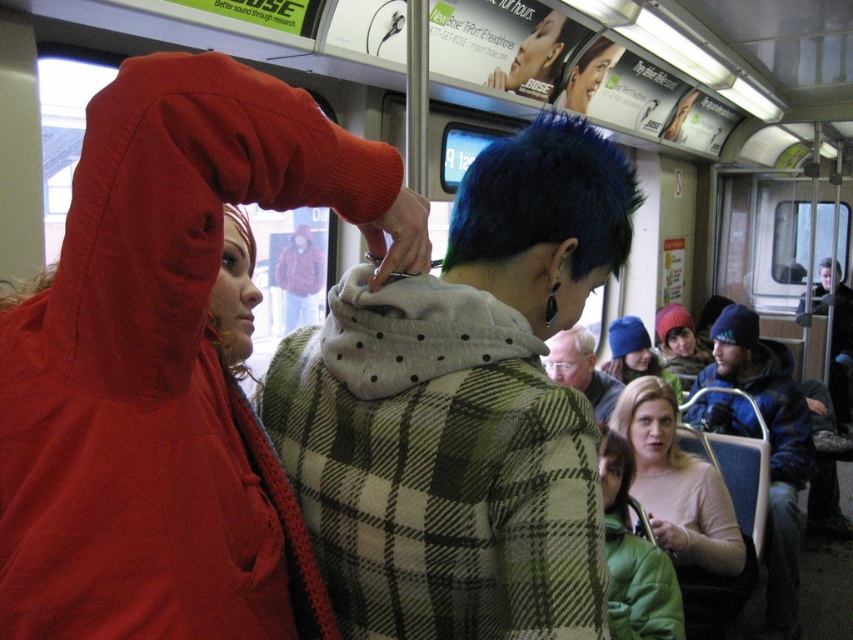
In the scene shown: You are a passenger on a subway train and you see the dark blue knit cap at upper right and the short dark hair at center. Which one is located more to the right side of the train car?

The dark blue knit cap at upper right is more to the right side of the train car because it is positioned on the right side of the short dark hair at center.

Based on the scene description, where is the gray woolen sweater at center located in terms of coordinates?

The gray woolen sweater at center is located at coordinates point (581, 369).